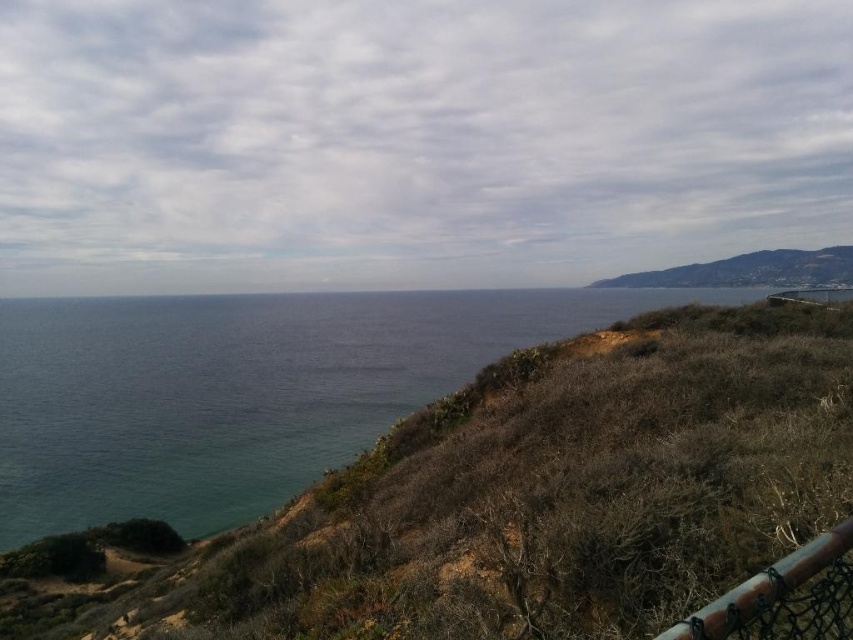
Is brown mesh fence at lower right in front of brown grassy hillside at upper right?

Yes, brown mesh fence at lower right is closer to the viewer.

Which is more to the left, brown mesh fence at lower right or brown grassy hillside at upper right?

brown mesh fence at lower right is more to the left.

Between point (833, 579) and point (714, 280), which one is positioned in front?

Positioned in front is point (833, 579).

The width and height of the screenshot is (853, 640). What are the coordinates of `brown mesh fence at lower right` in the screenshot? It's located at (784, 596).

Which is above, blue water at center or brown mesh fence at lower right?

blue water at center is above.

Does blue water at center have a lesser width compared to brown mesh fence at lower right?

No, blue water at center is not thinner than brown mesh fence at lower right.

Between point (512, 324) and point (756, 588), which one is positioned in front?

Positioned in front is point (756, 588).

Find the location of `blue water at center`. blue water at center is located at coordinates (242, 390).

Measure the distance from blue water at center to brown grassy hillside at upper right.

blue water at center and brown grassy hillside at upper right are 343.80 feet apart.

In the scene shown: Can you confirm if blue water at center is positioned to the right of brown grassy hillside at upper right?

Incorrect, blue water at center is not on the right side of brown grassy hillside at upper right.

This screenshot has height=640, width=853. I want to click on blue water at center, so click(242, 390).

I want to click on blue water at center, so click(x=242, y=390).